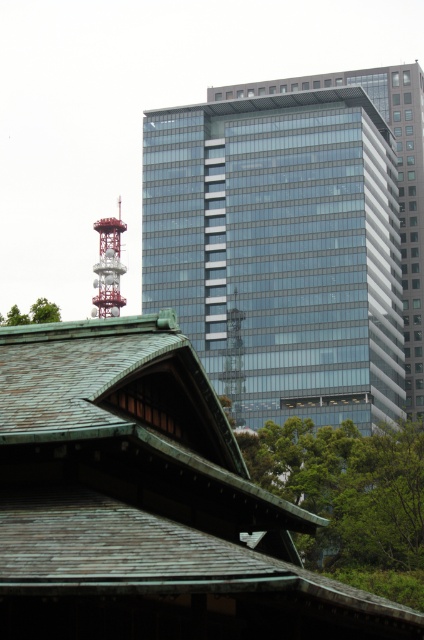
Is glassy reflective building at center further to camera compared to green leafy tree at center?

Yes, glassy reflective building at center is behind green leafy tree at center.

Who is taller, glassy reflective building at center or green leafy tree at center?

glassy reflective building at center

Is point (407, 136) positioned in front of point (371, 476)?

That is False.

Where is `glassy reflective building at center`? This screenshot has height=640, width=424. glassy reflective building at center is located at coordinates (293, 241).

Is green leafy tree at center shorter than red painted metal tokyo tower at upper left?

Indeed, green leafy tree at center has a lesser height compared to red painted metal tokyo tower at upper left.

Between green leafy tree at center and red painted metal tokyo tower at upper left, which one has less height?

green leafy tree at center is shorter.

Does point (331, 448) come in front of point (113, 227)?

Yes, point (331, 448) is closer to viewer.

You are a GUI agent. You are given a task and a screenshot of the screen. Output one action in this format:
    pyautogui.click(x=<x>, y=<y>)
    Task: Click on the green leafy tree at center
    The height and width of the screenshot is (640, 424).
    Given the screenshot: What is the action you would take?
    pyautogui.click(x=346, y=488)

Does red painted metal tokyo tower at upper left have a lesser height compared to green leafy tree at upper left?

In fact, red painted metal tokyo tower at upper left may be taller than green leafy tree at upper left.

Can you confirm if red painted metal tokyo tower at upper left is positioned above green leafy tree at upper left?

Yes, red painted metal tokyo tower at upper left is above green leafy tree at upper left.

Measure the distance between point (119, 218) and camera.

The distance of point (119, 218) from camera is 254.42 meters.

The image size is (424, 640). What are the coordinates of `red painted metal tokyo tower at upper left` in the screenshot? It's located at (x=108, y=266).